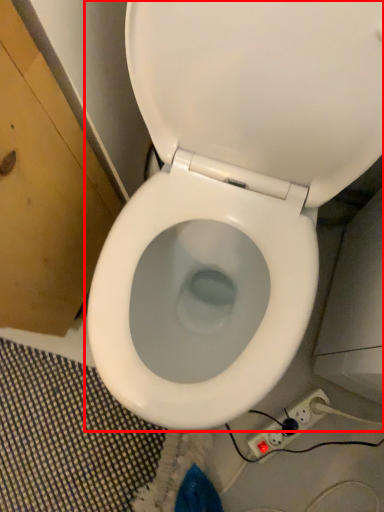
Question: Where is toilet (annotated by the red box) located in relation to electric outlet in the image?

Choices:
 (A) left
 (B) right

Answer: (A)